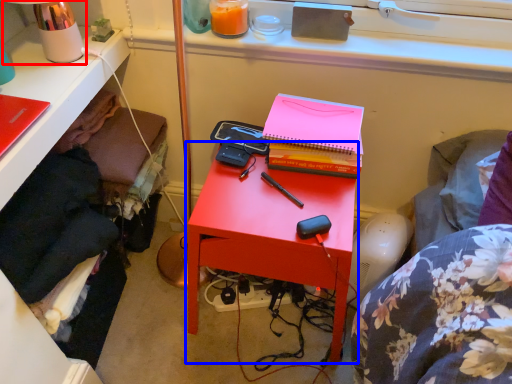
Question: Which object is further to the camera taking this photo, table lamp (highlighted by a red box) or nightstand (highlighted by a blue box)?

Choices:
 (A) table lamp
 (B) nightstand

Answer: (B)